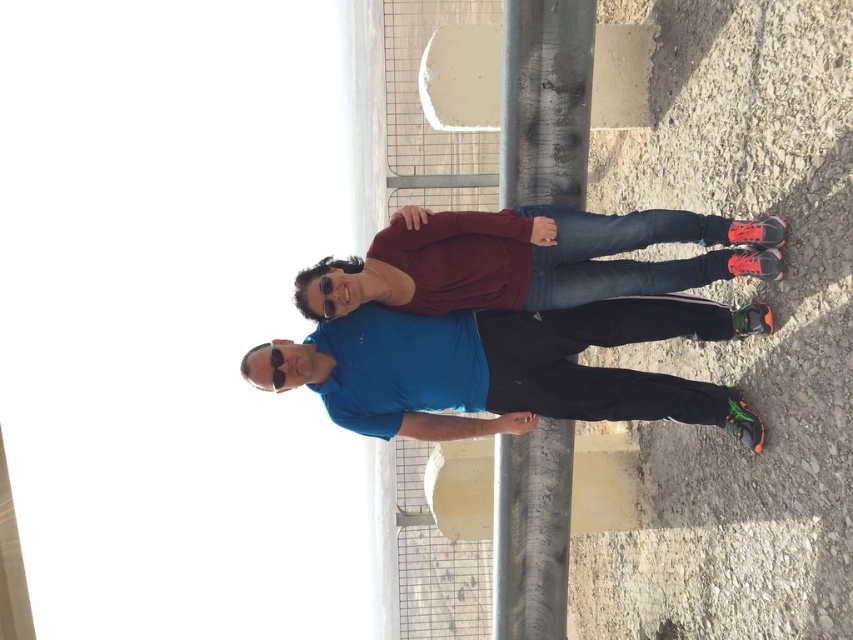
Question: Is matte maroon sweater at center thinner than metallic gray pole at center?

Choices:
 (A) yes
 (B) no

Answer: (B)

Question: Which point is closer to the camera?

Choices:
 (A) (708, 314)
 (B) (575, 106)
 (C) (575, 212)

Answer: (A)

Question: Can you confirm if blue matte shirt at center is positioned below matte maroon sweater at center?

Choices:
 (A) no
 (B) yes

Answer: (B)

Question: Which point is farther to the camera?

Choices:
 (A) blue matte shirt at center
 (B) metallic gray pole at center
 (C) matte maroon sweater at center

Answer: (B)

Question: Does matte maroon sweater at center appear under metallic gray pole at center?

Choices:
 (A) no
 (B) yes

Answer: (A)

Question: Which object is farther from the camera taking this photo?

Choices:
 (A) matte maroon sweater at center
 (B) blue matte shirt at center

Answer: (B)